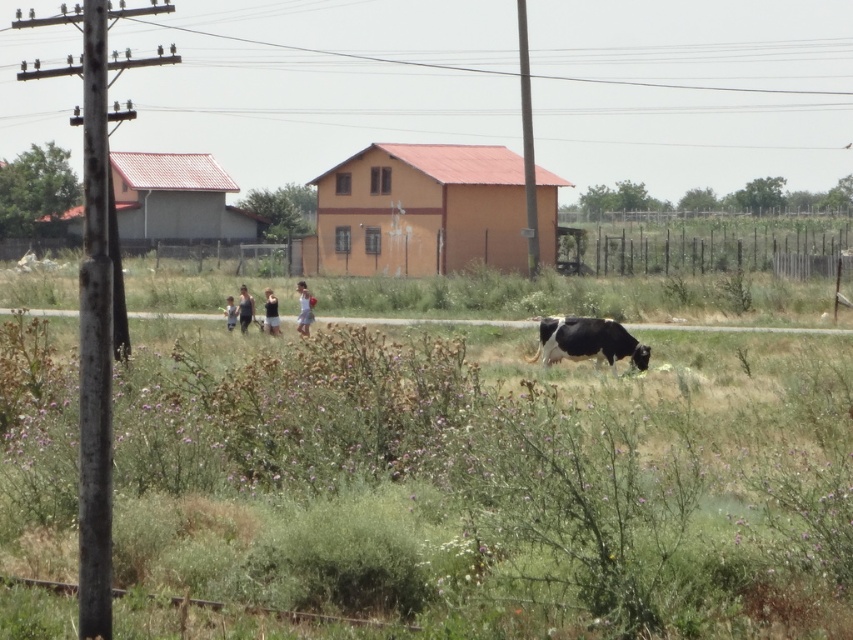
Question: Is white cotton shirt at center to the right of black fabric person at center from the viewer's perspective?

Choices:
 (A) yes
 (B) no

Answer: (A)

Question: Estimate the real-world distances between objects in this image. Which object is farther from the dark gray fabric shirt at center?

Choices:
 (A) dark blue tank top at center
 (B) white cotton shirt at center
 (C) black and white spotted bull at center
 (D) black fabric person at center

Answer: (C)

Question: Which of the following is the farthest from the observer?

Choices:
 (A) (267, 298)
 (B) (305, 292)
 (C) (552, 346)

Answer: (B)

Question: Does black and white spotted bull at center have a smaller size compared to dark blue tank top at center?

Choices:
 (A) yes
 (B) no

Answer: (B)

Question: Among these objects, which one is farthest from the camera?

Choices:
 (A) black and white spotted bull at center
 (B) dark blue tank top at center
 (C) white cotton shirt at center

Answer: (B)

Question: Does black and white spotted bull at center appear on the right side of white cotton shirt at center?

Choices:
 (A) yes
 (B) no

Answer: (A)